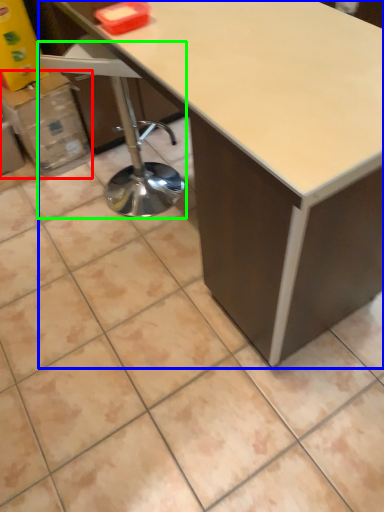
Question: Which object is positioned farthest from cardboard box (highlighted by a red box)? Select from table (highlighted by a blue box) and swivel chair (highlighted by a green box).

Choices:
 (A) table
 (B) swivel chair

Answer: (A)